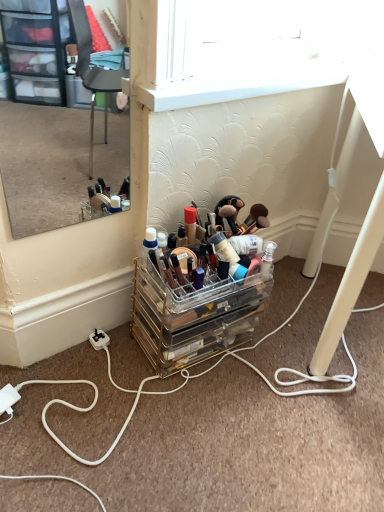
The image size is (384, 512). Identify the location of free location in front of white plastic power outlet at lower left. (86, 386).